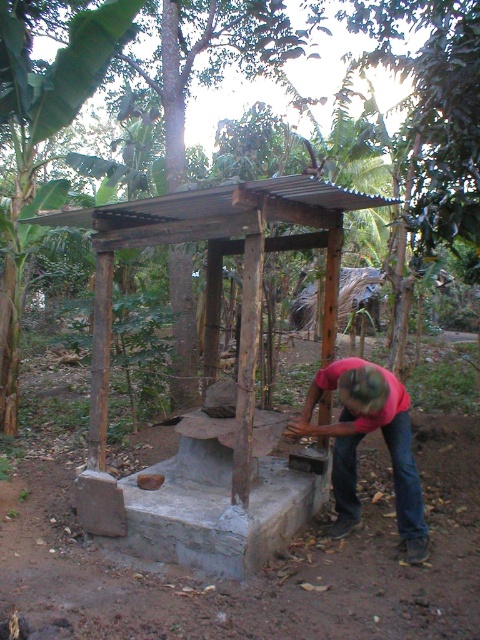
You are standing in the tropical garden and want to take a photo of the rustic wooden gazebo at center. However, there is a person in the way wearing a red fabric shirt at center. Can you still capture the gazebo in your photo without the person blocking it?

The rustic wooden gazebo at center is closer to the viewer than the red fabric shirt at center, so the gazebo will be in front of the person. This means the gazebo will block the view of the person, allowing you to take a photo of the gazebo without the person blocking it.

You are standing at the origin point of the image coordinate system. The image coordinate system has its origin at the bottom left corner. The gazebo is at point 0.598, 0.494. If you want to walk directly to the rustic wooden gazebo at center, in which direction should you move relative to the coordinate system?

Since the rustic wooden gazebo at center is located at coordinate point (237, 381), which is to the right and above the origin point, you should move in the positive x and positive y direction to reach it.